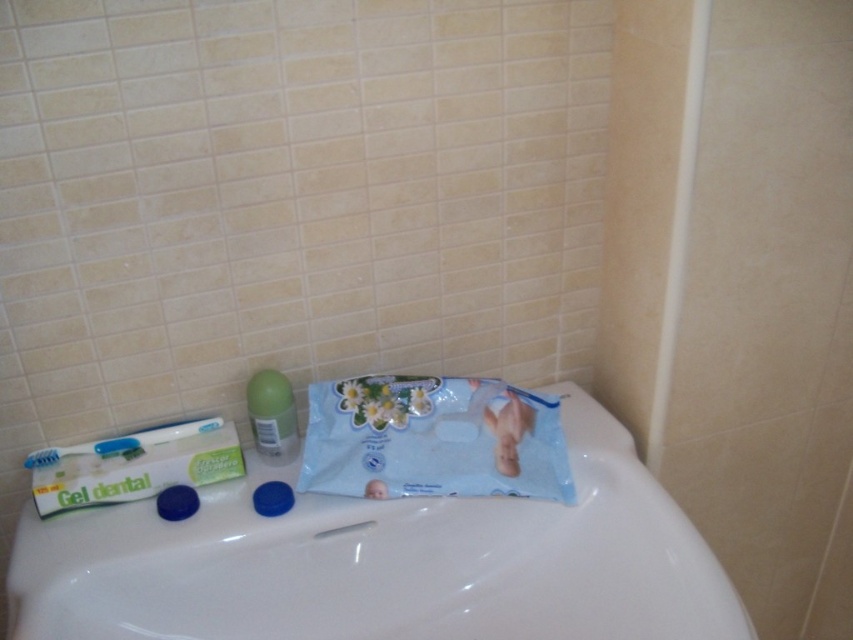
You are a home inspector assessing the bathroom layout. The white glossy sink at center and blue plastic toothbrush at left are both on the bathroom counter. Which object has a greater width?

The white glossy sink at center has a greater width than the blue plastic toothbrush at left.

You are organizing the items on the toilet tank lid. You need to place a new item at the exact location marked by point (x=135, y=465). What item is currently occupying that spot?

The white matte toothpaste at lower left is occupying the location marked by point (x=135, y=465).